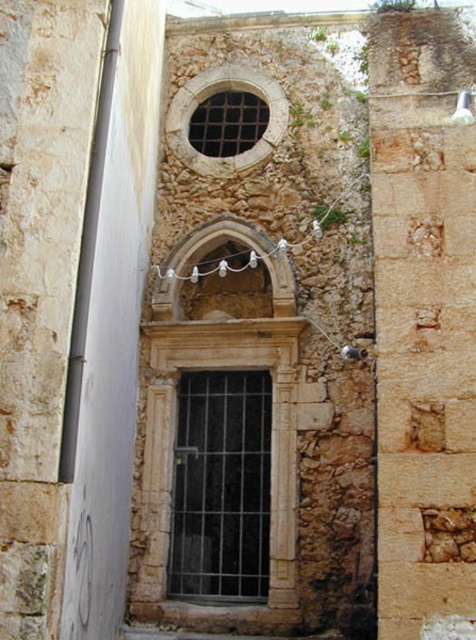
Question: Is stone textured window at upper center behind matte stone window at upper center?

Choices:
 (A) no
 (B) yes

Answer: (A)

Question: Which point is farther from the camera taking this photo?

Choices:
 (A) (215, 124)
 (B) (176, 138)
 (C) (174, 307)
 (D) (265, 582)

Answer: (A)

Question: Is white stone archway at center to the left of matte stone window at upper center from the viewer's perspective?

Choices:
 (A) no
 (B) yes

Answer: (B)

Question: Among these points, which one is farthest from the camera?

Choices:
 (A) (194, 420)
 (B) (265, 92)
 (C) (235, 115)
 (D) (288, 273)

Answer: (C)

Question: Can you confirm if stone textured window at upper center is positioned to the right of matte stone window at upper center?

Choices:
 (A) yes
 (B) no

Answer: (B)

Question: Estimate the real-world distances between objects in this image. Which object is closer to the white stone archway at center?

Choices:
 (A) stone textured window at upper center
 (B) black metal window at center

Answer: (A)